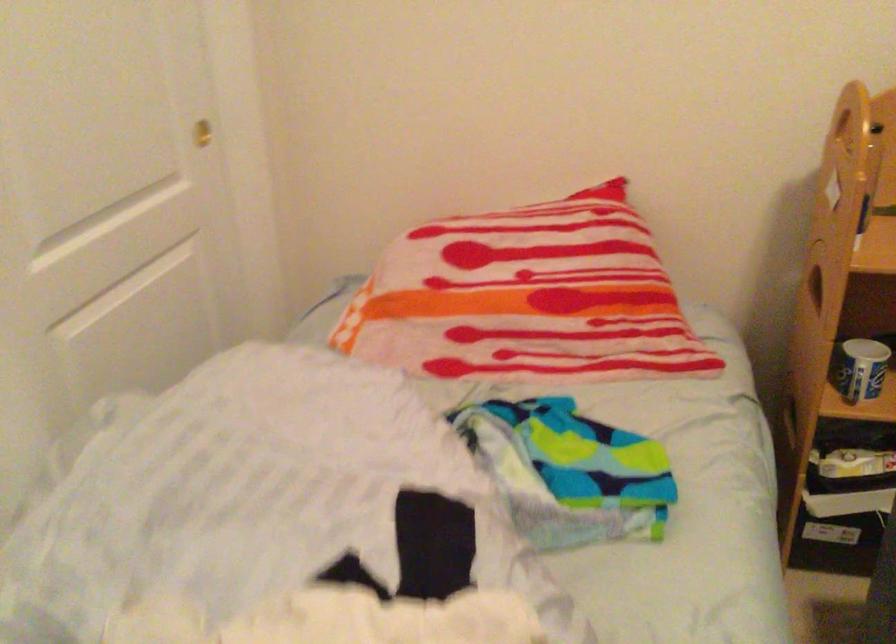
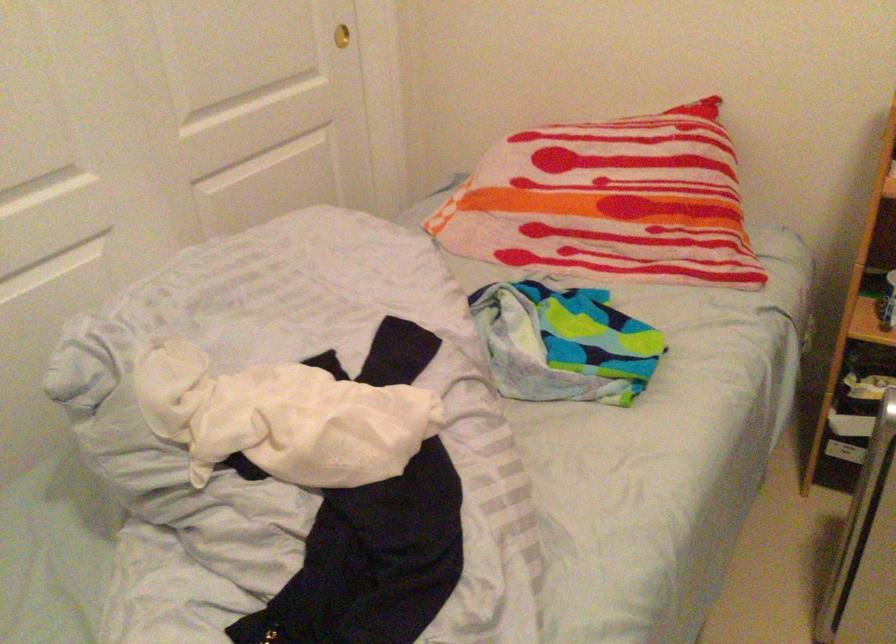
Where in the second image is the point corresponding to (x=204, y=134) from the first image?

(340, 35)